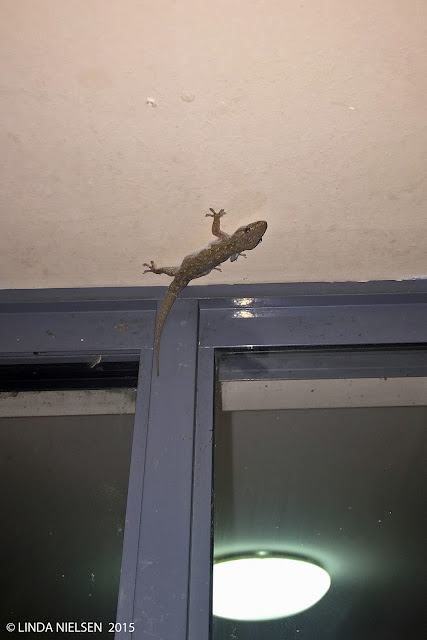
Where is `ceiling`? ceiling is located at coordinates (324, 132).